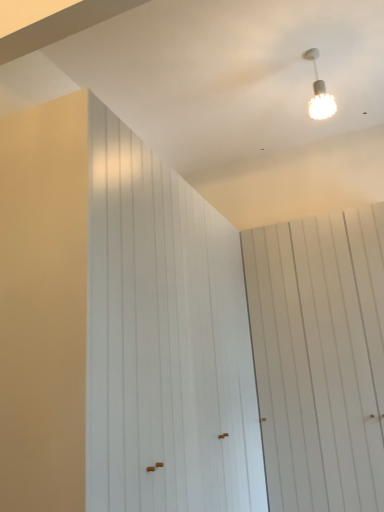
Question: Looking at the image, does white textured lampshade at upper right seem bigger or smaller compared to white wood barn door at left, positioned as the 2th barn door in right-to-left order?

Choices:
 (A) small
 (B) big

Answer: (A)

Question: From the image's perspective, is white textured lampshade at upper right positioned above or below white wood barn door at left, positioned as the 2th barn door in right-to-left order?

Choices:
 (A) above
 (B) below

Answer: (A)

Question: Which of these objects is positioned closest to the white wood barn door at upper right, the 2th barn door positioned from the left?

Choices:
 (A) white textured lampshade at upper right
 (B) white wood barn door at left, positioned as the 2th barn door in right-to-left order

Answer: (B)

Question: Estimate the real-world distances between objects in this image. Which object is farther from the white textured lampshade at upper right?

Choices:
 (A) white wood barn door at left, the first barn door viewed from the left
 (B) white wood barn door at upper right, the 1th barn door when ordered from right to left

Answer: (A)